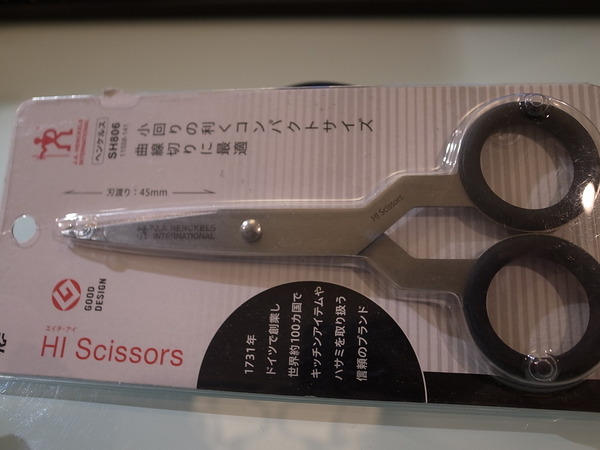
At what (x,y) coordinates should I click in order to perform the action: click on table. Please return your answer as a coordinate pair (x, y). Looking at the image, I should click on (432, 36), (124, 427).